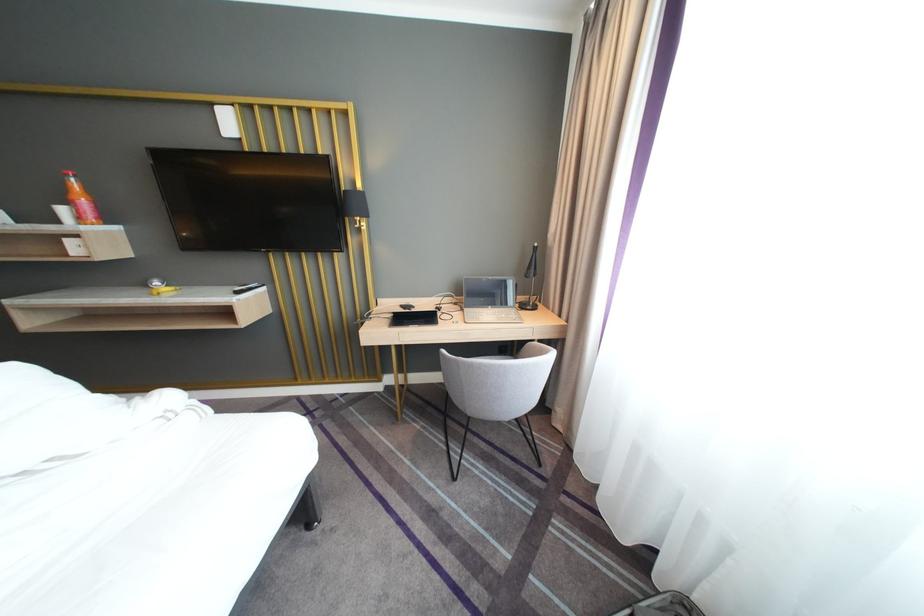
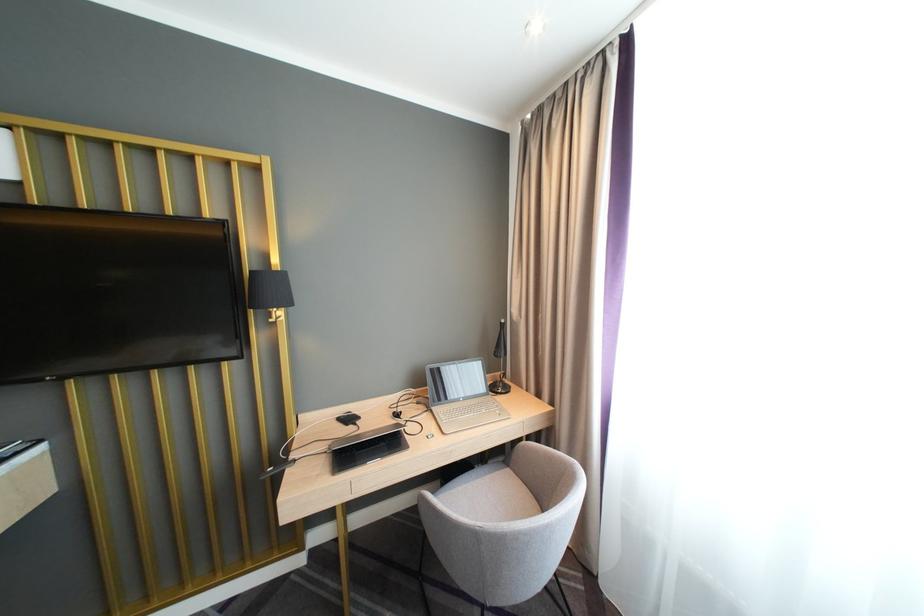
In the second image, find the point that corresponds to (x=535, y=307) in the first image.

(505, 390)